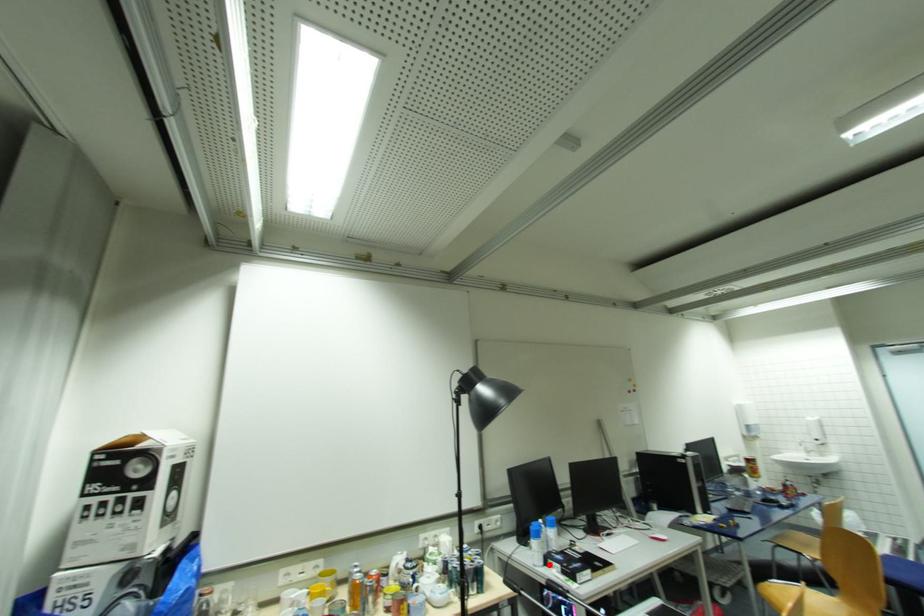
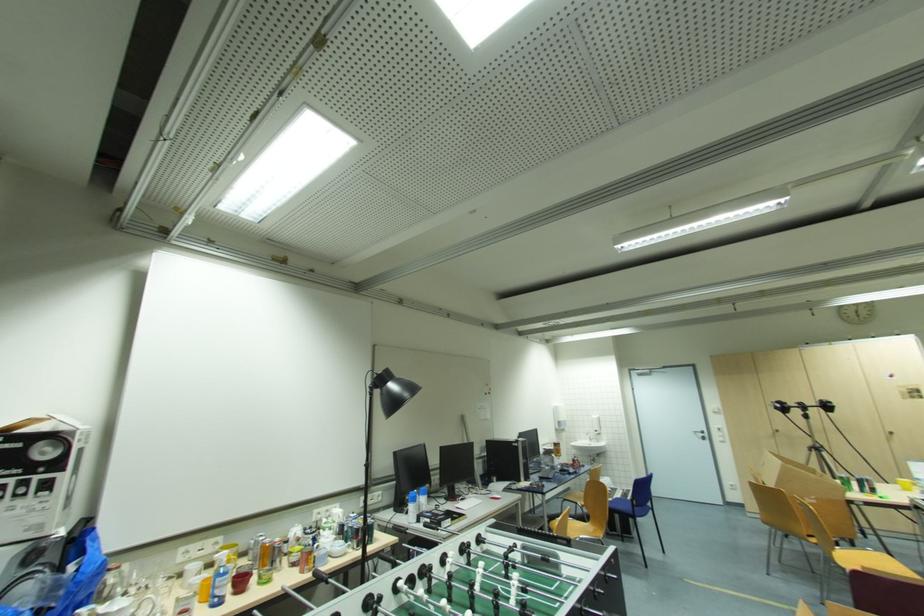
Question: I am providing you with two images of the same scene from different viewpoints. In image1, a red point is highlighted. Considering the same 3D point in image2, which of the following is correct?

Choices:
 (A) It is closer
 (B) It is farther

Answer: (B)